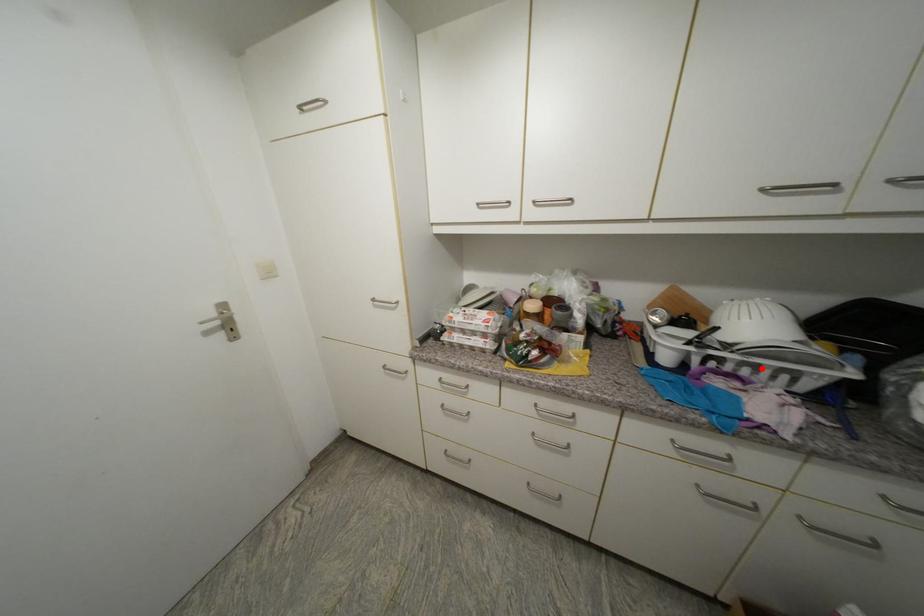
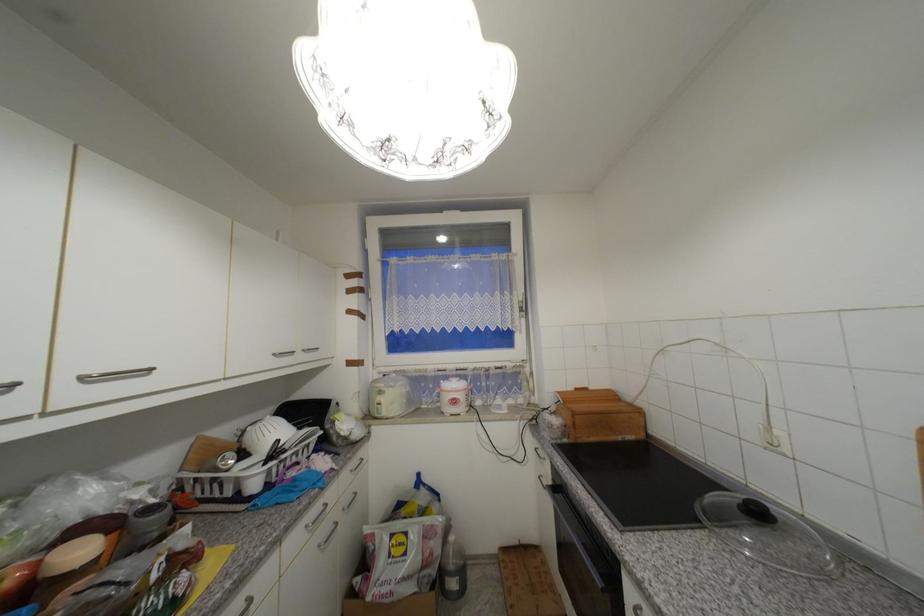
The point at the highlighted location is marked in the first image. Where is the corresponding point in the second image?

(301, 454)